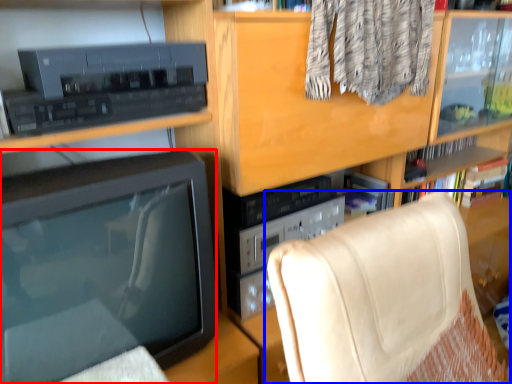
Question: Which object is closer to the camera taking this photo, television (highlighted by a red box) or furniture (highlighted by a blue box)?

Choices:
 (A) television
 (B) furniture

Answer: (B)